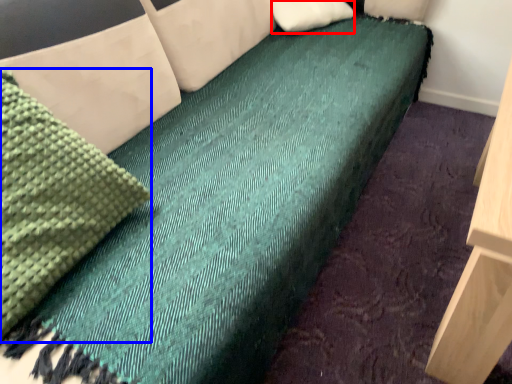
Question: Among these objects, which one is farthest to the camera, pillow (highlighted by a red box) or material (highlighted by a blue box)?

Choices:
 (A) pillow
 (B) material

Answer: (A)